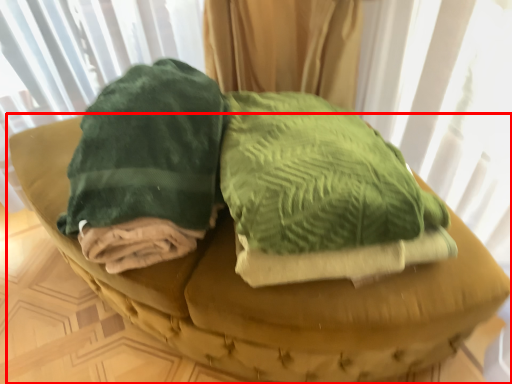
Question: From the image, what is the correct spatial relationship of furniture (annotated by the red box) in relation to cloth?

Choices:
 (A) left
 (B) right

Answer: (B)